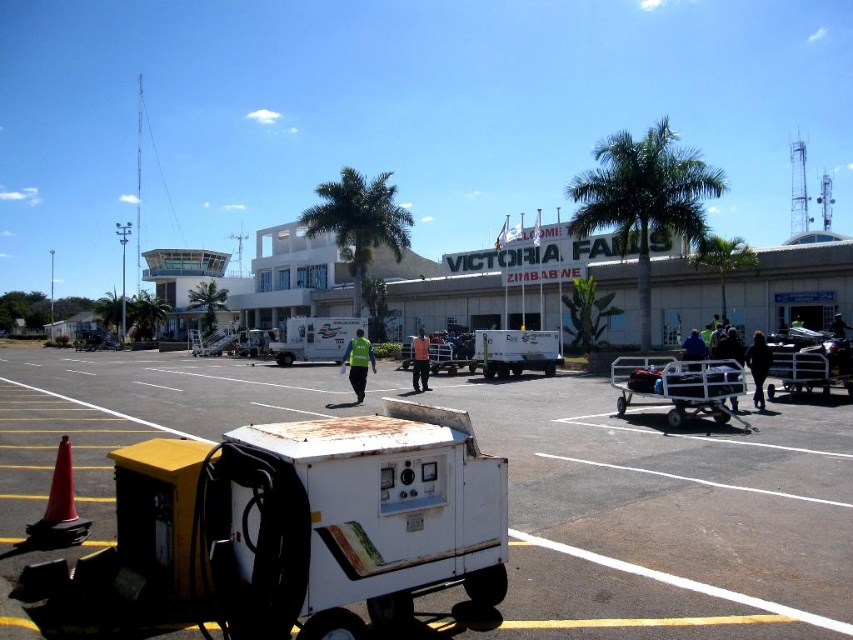
Measure the distance between metallic luggage cart at center and camera.

metallic luggage cart at center is 11.60 meters from camera.

Between metallic luggage cart at center and black fabric person at center, which one has more height?

black fabric person at center

Which is behind, point (704, 404) or point (761, 356)?

The point (761, 356) is behind.

Where is `metallic luggage cart at center`? This screenshot has height=640, width=853. metallic luggage cart at center is located at coordinates (679, 387).

Is point (692, 372) farther from viewer compared to point (422, 349)?

No, it is in front of (422, 349).

Which is behind, point (659, 372) or point (422, 372)?

The point (422, 372) is behind.

I want to click on metallic luggage cart at center, so click(679, 387).

Is point (505, 419) in front of point (734, 368)?

That is False.

Between point (817, 564) and point (699, 410), which one is positioned behind?

Point (699, 410)

Locate an element on the screen. The height and width of the screenshot is (640, 853). white matte generator at center is located at coordinates (665, 515).